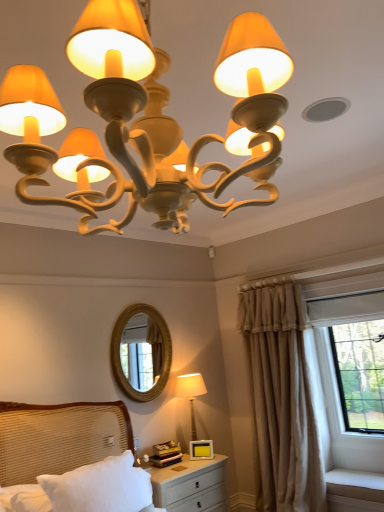
What do you see at coordinates (191, 393) in the screenshot? The width and height of the screenshot is (384, 512). I see `matte cream lamp at lower center, placed as the 1th lamp when sorted from back to front` at bounding box center [191, 393].

Measure the distance between point (116, 63) and camera.

The distance of point (116, 63) from camera is 27.24 inches.

In order to face beige fabric curtain at right, should I rotate leftwards or rightwards?

It's best to rotate right around 11.083 degrees.

Image resolution: width=384 pixels, height=512 pixels. What do you see at coordinates (151, 351) in the screenshot? I see `gold textured mirror at center` at bounding box center [151, 351].

Find the location of a particular element. The image size is (384, 512). white textured bed at lower left is located at coordinates (55, 445).

In the image, is matte cream chandelier at upper center, the second lamp ordered from the bottom, on the left side or the right side of white textured bed at lower left?

Based on their positions, matte cream chandelier at upper center, the second lamp ordered from the bottom, is located to the right of white textured bed at lower left.

From a real-world perspective, is matte cream chandelier at upper center, the second lamp ordered from the bottom, physically located above or below white textured bed at lower left?

matte cream chandelier at upper center, the second lamp ordered from the bottom, is above white textured bed at lower left.

From the image's perspective, which one is positioned lower, matte cream chandelier at upper center, the 2th lamp from the back, or white textured bed at lower left?

white textured bed at lower left.

From a real-world perspective, between beige fabric curtain at right and white matte nightstand at lower center, who is vertically higher?

beige fabric curtain at right is physically above.

Is white matte nightstand at lower center located within beige fabric curtain at right?

No.

I want to click on curtain lying on the right of white matte nightstand at lower center, so click(x=281, y=399).

Considering the positions of objects beige fabric curtain at right and white matte nightstand at lower center in the image provided, who is behind, beige fabric curtain at right or white matte nightstand at lower center?

beige fabric curtain at right is behind.

Can you confirm if beige fabric curtain at right is wider than matte cream lamp at lower center, placed as the 1th lamp when sorted from back to front?

Indeed, beige fabric curtain at right has a greater width compared to matte cream lamp at lower center, placed as the 1th lamp when sorted from back to front.

Which is closer to the camera, (x=295, y=376) or (x=184, y=388)?

The point (x=295, y=376) is more forward.

Would you say beige fabric curtain at right is a long distance from matte cream lamp at lower center, placed as the 1th lamp when sorted from back to front?

Actually, beige fabric curtain at right and matte cream lamp at lower center, placed as the 1th lamp when sorted from back to front, are a little close together.

Considering the positions of objects beige fabric curtain at right and matte cream lamp at lower center, the 2th lamp positioned from the front, in the image provided, who is in front, beige fabric curtain at right or matte cream lamp at lower center, the 2th lamp positioned from the front,?

beige fabric curtain at right is more forward.

Who is bigger, white matte nightstand at lower center or white textured bed at lower left?

With larger size is white matte nightstand at lower center.

From the image's perspective, between white matte nightstand at lower center and white textured bed at lower left, who is located below?

white matte nightstand at lower center is shown below in the image.

How different are the orientations of white matte nightstand at lower center and white textured bed at lower left in degrees?

There is a 2.64-degree angle between the facing directions of white matte nightstand at lower center and white textured bed at lower left.

In the scene shown: Considering the relative sizes of white matte nightstand at lower center and white textured bed at lower left in the image provided, is white matte nightstand at lower center wider than white textured bed at lower left?

Yes, white matte nightstand at lower center is wider than white textured bed at lower left.

Which object is wider, gold textured mirror at center or beige fabric curtain at right?

beige fabric curtain at right.

Is gold textured mirror at center facing away from beige fabric curtain at right?

No.

Is matte cream chandelier at upper center, the 2th lamp from the back, a part of gold textured mirror at center?

Definitely not — matte cream chandelier at upper center, the 2th lamp from the back, is not inside gold textured mirror at center.

From the image's perspective, which one is positioned higher, gold textured mirror at center or matte cream chandelier at upper center, the 2th lamp from the back?

From the image's view, matte cream chandelier at upper center, the 2th lamp from the back, is above.

Considering their positions, is gold textured mirror at center located in front of or behind matte cream chandelier at upper center, which is counted as the 1th lamp, starting from the top?

gold textured mirror at center is behind matte cream chandelier at upper center, which is counted as the 1th lamp, starting from the top.

From a real-world perspective, relative to matte cream chandelier at upper center, the first lamp positioned from the front, is gold textured mirror at center vertically above or below?

gold textured mirror at center is situated lower than matte cream chandelier at upper center, the first lamp positioned from the front, in the real world.

Does point (192, 398) lie in front of point (185, 164)?

No, it is behind (185, 164).

Is matte cream lamp at lower center, placed as the 1th lamp when sorted from back to front, at the right side of matte cream chandelier at upper center, the second lamp ordered from the bottom?

Yes, matte cream lamp at lower center, placed as the 1th lamp when sorted from back to front, is to the right of matte cream chandelier at upper center, the second lamp ordered from the bottom.

At what (x,y) coordinates should I click in order to perform the action: click on lamp on the left of matte cream lamp at lower center, placed as the 2th lamp when sorted from top to bottom. Please return your answer as a coordinate pair (x, y). This screenshot has height=512, width=384. Looking at the image, I should click on (146, 119).

From a real-world perspective, is matte cream lamp at lower center, placed as the 1th lamp when sorted from back to front, located higher than matte cream chandelier at upper center, the 2th lamp from the back?

Actually, matte cream lamp at lower center, placed as the 1th lamp when sorted from back to front, is physically below matte cream chandelier at upper center, the 2th lamp from the back, in the real world.

The height and width of the screenshot is (512, 384). Find the location of `the 1st lamp counting from the right side of the white textured bed at lower left`. the 1st lamp counting from the right side of the white textured bed at lower left is located at coordinates (146, 119).

This screenshot has height=512, width=384. In order to click on curtain that is above the white matte nightstand at lower center (from the image's perspective) in this screenshot , I will do `click(281, 399)`.

When comparing their distances from white textured bed at lower left, does white matte nightstand at lower center or beige fabric curtain at right seem closer?

The object closer to white textured bed at lower left is white matte nightstand at lower center.

Looking at the image, which one is located further to white textured bed at lower left, gold textured mirror at center or matte cream lamp at lower center, placed as the 2th lamp when sorted from top to bottom?

The object further to white textured bed at lower left is matte cream lamp at lower center, placed as the 2th lamp when sorted from top to bottom.

Estimate the real-world distances between objects in this image. Which object is further from beige fabric curtain at right, matte cream lamp at lower center, the 2th lamp positioned from the front, or white matte nightstand at lower center?

Among the two, white matte nightstand at lower center is located further to beige fabric curtain at right.

Estimate the real-world distances between objects in this image. Which object is further from white matte nightstand at lower center, matte cream lamp at lower center, the 2th lamp positioned from the front, or matte cream chandelier at upper center, the second lamp ordered from the bottom?

matte cream chandelier at upper center, the second lamp ordered from the bottom.

Estimate the real-world distances between objects in this image. Which object is further from beige fabric curtain at right, matte cream chandelier at upper center, the first lamp positioned from the front, or white textured bed at lower left?

matte cream chandelier at upper center, the first lamp positioned from the front, is positioned further to the anchor beige fabric curtain at right.

Considering their positions, is white textured bed at lower left positioned further to white matte nightstand at lower center than beige fabric curtain at right?

beige fabric curtain at right lies further to white matte nightstand at lower center than the other object.

Based on their spatial positions, is white textured bed at lower left or gold textured mirror at center closer to matte cream lamp at lower center, placed as the 1th lamp when sorted from back to front?

gold textured mirror at center is closer to matte cream lamp at lower center, placed as the 1th lamp when sorted from back to front.

Looking at the image, which one is located further to beige fabric curtain at right, white textured bed at lower left or matte cream lamp at lower center, the 2th lamp positioned from the front?

white textured bed at lower left.

The width and height of the screenshot is (384, 512). Identify the location of mirror between white textured bed at lower left and beige fabric curtain at right. (151, 351).

Identify the location of nightstand between gold textured mirror at center and beige fabric curtain at right in the horizontal direction. The image size is (384, 512). 190,484.

The height and width of the screenshot is (512, 384). Find the location of `mirror between white textured bed at lower left and matte cream lamp at lower center, placed as the 1th lamp when sorted from back to front, from front to back`. mirror between white textured bed at lower left and matte cream lamp at lower center, placed as the 1th lamp when sorted from back to front, from front to back is located at coordinates (151, 351).

Find the location of `nightstand between white textured bed at lower left and gold textured mirror at center along the z-axis`. nightstand between white textured bed at lower left and gold textured mirror at center along the z-axis is located at coordinates (190, 484).